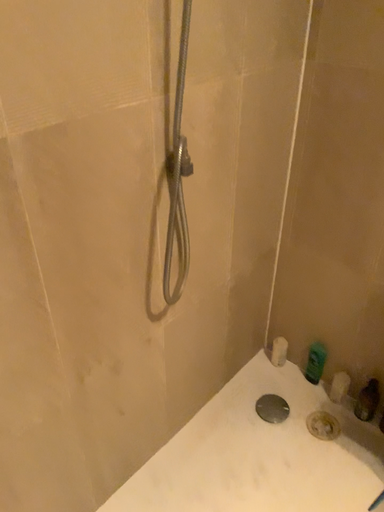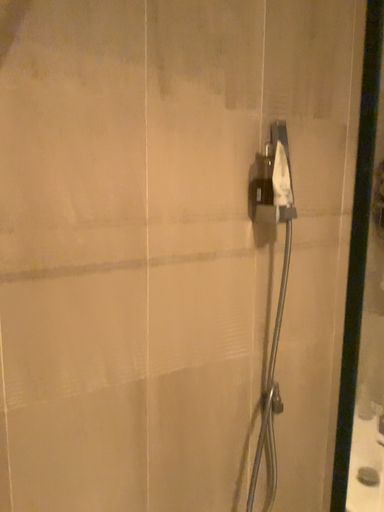
Question: Which way did the camera rotate in the video?

Choices:
 (A) rotated downward
 (B) rotated upward

Answer: (B)